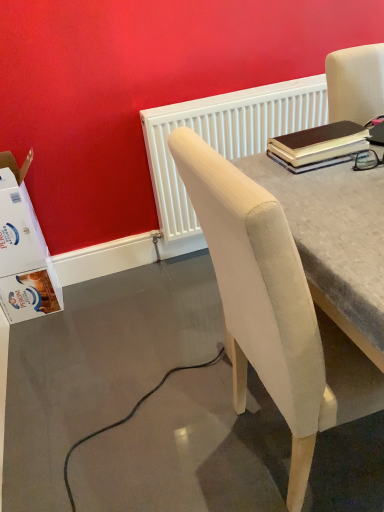
Question: Would you say white textured radiator at upper center contains beige fabric chair at upper right?

Choices:
 (A) yes
 (B) no

Answer: (B)

Question: Is white textured radiator at upper center further to camera compared to beige fabric chair at upper right?

Choices:
 (A) no
 (B) yes

Answer: (B)

Question: Is white textured radiator at upper center oriented towards beige fabric chair at upper right?

Choices:
 (A) no
 (B) yes

Answer: (B)

Question: Can you confirm if white textured radiator at upper center is wider than beige fabric chair at upper right?

Choices:
 (A) no
 (B) yes

Answer: (A)

Question: From the image's perspective, does white textured radiator at upper center appear lower than beige fabric chair at upper right?

Choices:
 (A) yes
 (B) no

Answer: (B)

Question: Is white textured radiator at upper center in front of or behind beige fabric chair at upper right in the image?

Choices:
 (A) front
 (B) behind

Answer: (B)

Question: From the image's perspective, is white textured radiator at upper center above or below beige fabric chair at upper right?

Choices:
 (A) below
 (B) above

Answer: (B)

Question: Based on their sizes in the image, would you say white textured radiator at upper center is bigger or smaller than beige fabric chair at upper right?

Choices:
 (A) big
 (B) small

Answer: (B)

Question: In the image, is white textured radiator at upper center on the left side or the right side of beige fabric chair at upper right?

Choices:
 (A) left
 (B) right

Answer: (A)

Question: In the image, is beige fabric chair at upper right positioned in front of or behind white cardboard box at lower left?

Choices:
 (A) front
 (B) behind

Answer: (A)

Question: Is beige fabric chair at upper right to the left or to the right of white cardboard box at lower left in the image?

Choices:
 (A) right
 (B) left

Answer: (A)

Question: Considering the positions of beige fabric chair at upper right and white cardboard box at lower left in the image, is beige fabric chair at upper right taller or shorter than white cardboard box at lower left?

Choices:
 (A) short
 (B) tall

Answer: (B)

Question: Looking at their shapes, would you say beige fabric chair at upper right is wider or thinner than white cardboard box at lower left?

Choices:
 (A) wide
 (B) thin

Answer: (A)

Question: Based on their positions, is brown leather notebook at upper right located to the left or right of beige fabric chair at upper right?

Choices:
 (A) right
 (B) left

Answer: (B)

Question: From the image's perspective, relative to beige fabric chair at upper right, is brown leather notebook at upper right above or below?

Choices:
 (A) above
 (B) below

Answer: (A)